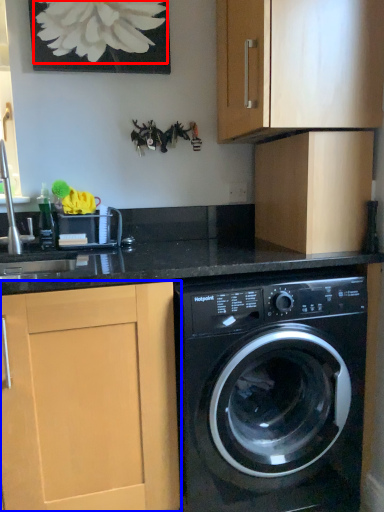
Question: Which point is closer to the camera, flower (highlighted by a red box) or cabinetry (highlighted by a blue box)?

Choices:
 (A) flower
 (B) cabinetry

Answer: (B)